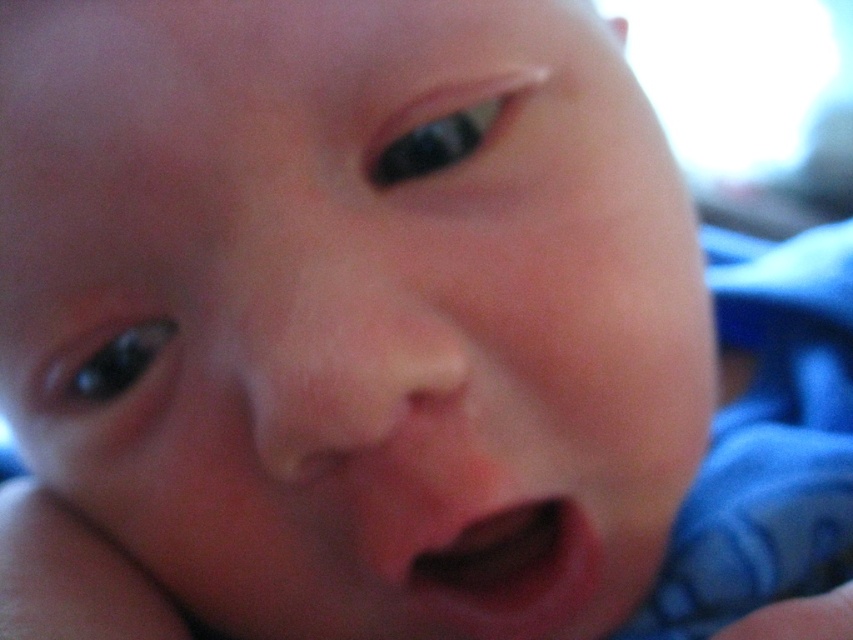
Is pink smooth flesh at center positioned at the back of smooth skin hand at lower right?

Yes.

Based on the photo, can you confirm if pink smooth flesh at center is wider than smooth skin hand at lower right?

No.

Describe the element at coordinates (512, 570) in the screenshot. This screenshot has height=640, width=853. I see `pink smooth flesh at center` at that location.

I want to click on pink smooth flesh at center, so click(x=512, y=570).